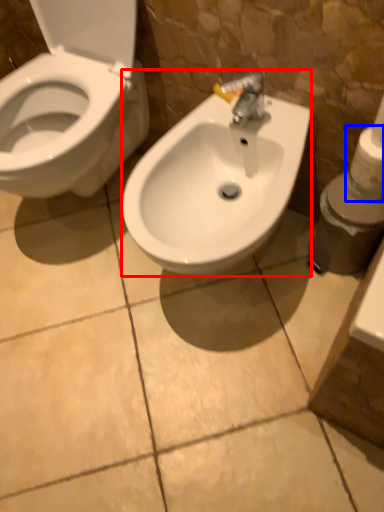
Question: Which point is closer to the camera, sink (highlighted by a red box) or toilet paper (highlighted by a blue box)?

Choices:
 (A) sink
 (B) toilet paper

Answer: (A)